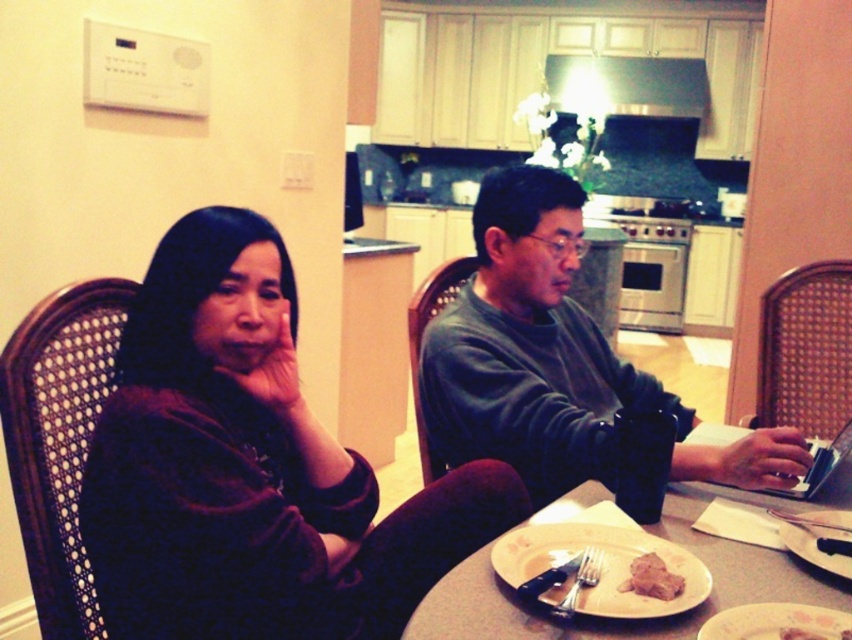
Can you confirm if white matte plate at lower center is smaller than white ceramic plate at lower right?

No.

Who is lower down, white matte plate at lower center or white ceramic plate at lower right?

white matte plate at lower center is lower down.

Does point (680, 568) come farther from viewer compared to point (844, 515)?

No, it is in front of (844, 515).

Locate an element on the screen. The width and height of the screenshot is (852, 640). white matte plate at lower center is located at coordinates (597, 566).

Looking at this image, can you confirm if dark brown fabric at left is taller than brown matte meat at center?

Yes, dark brown fabric at left is taller than brown matte meat at center.

How far apart are dark brown fabric at left and brown matte meat at center?

dark brown fabric at left is 22.45 inches from brown matte meat at center.

Is point (202, 433) positioned in front of point (629, 582)?

No, it is not.

Identify the location of dark brown fabric at left. (217, 454).

Which of these two, dark brown fabric at left or dark gray sweater at center, stands shorter?

dark brown fabric at left

From the picture: Can you confirm if dark brown fabric at left is positioned to the right of dark gray sweater at center?

No, dark brown fabric at left is not to the right of dark gray sweater at center.

Is point (213, 563) farther from camera compared to point (603, 401)?

That is False.

At what (x,y) coordinates should I click in order to perform the action: click on dark brown fabric at left. Please return your answer as a coordinate pair (x, y). Looking at the image, I should click on (217, 454).